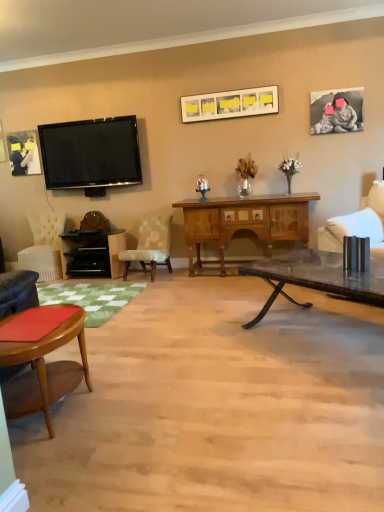
The height and width of the screenshot is (512, 384). In order to click on free spot in front of transparent glass coffee table at center in this screenshot , I will do `click(311, 404)`.